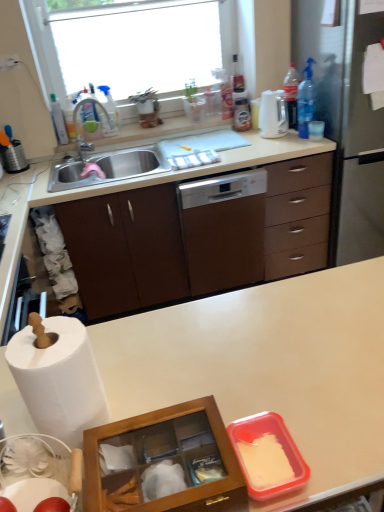
Question: From a real-world perspective, is white glossy dishwasher at center positioned above or below brushed metal grater at left?

Choices:
 (A) below
 (B) above

Answer: (A)

Question: Considering the positions of point (218, 210) and point (24, 168), is point (218, 210) closer or farther from the camera than point (24, 168)?

Choices:
 (A) closer
 (B) farther

Answer: (A)

Question: Which of these objects is positioned closest to the clear plastic bottle at upper right, which appears as the 3th bottle when viewed from the left?

Choices:
 (A) brushed metal grater at left
 (B) transparent plastic spray bottle at upper left, the 2th bottle when ordered from left to right
 (C) wooden glass at center
 (D) white glossy dishwasher at center
 (E) transparent glass window at upper center

Answer: (D)

Question: Which is nearer to the transparent plastic spray bottle at upper left, positioned as the 3th bottle in right-to-left order?

Choices:
 (A) white matte countertop at center
 (B) white glossy electric kettle at upper right
 (C) white glossy dishwasher at center
 (D) transparent glass window at upper center
 (E) translucent plastic bottle at upper left, arranged as the 1th bottle when viewed from the left

Answer: (E)